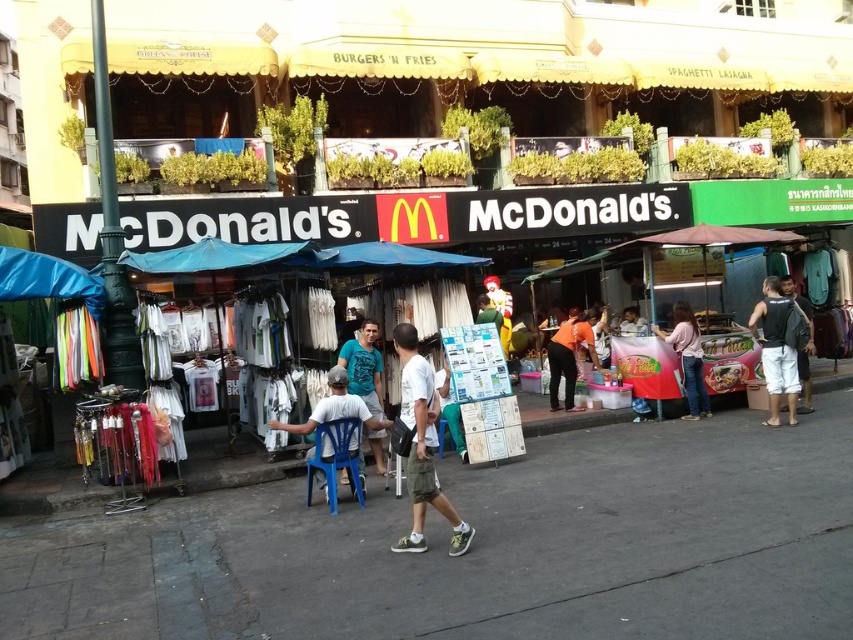
You are standing at the point marked by the coordinates (47, 280) in the image. What object are you under?

The point (47, 280) corresponds to the blue fabric canopy at left, so you are under the blue fabric canopy at left.

You are a delivery person who needs to place a package between the black backpack at right and the blue fabric canopy at left. The package requires a space of 8 meters. Can you fit it there?

The distance between the black backpack at right and the blue fabric canopy at left is 7.44 meters, so the package requiring 8 meters cannot fit in the available space.

You are standing in front of the McDonalds and see two backpacks at the right side of the scene. Which backpack is positioned to the left between the black backpack at right and the dark gray backpack at right?

The black backpack at right is positioned to the left of the dark gray backpack at right.